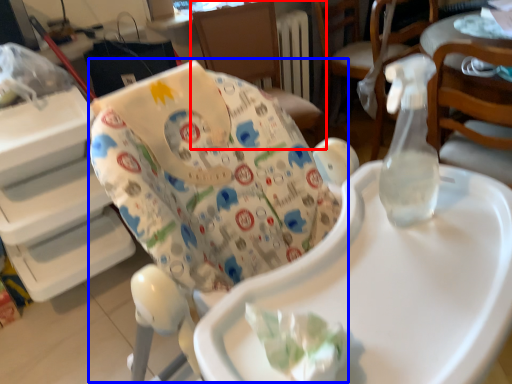
Question: Which object is further to the camera taking this photo, chair (highlighted by a red box) or rocking chair (highlighted by a blue box)?

Choices:
 (A) chair
 (B) rocking chair

Answer: (A)